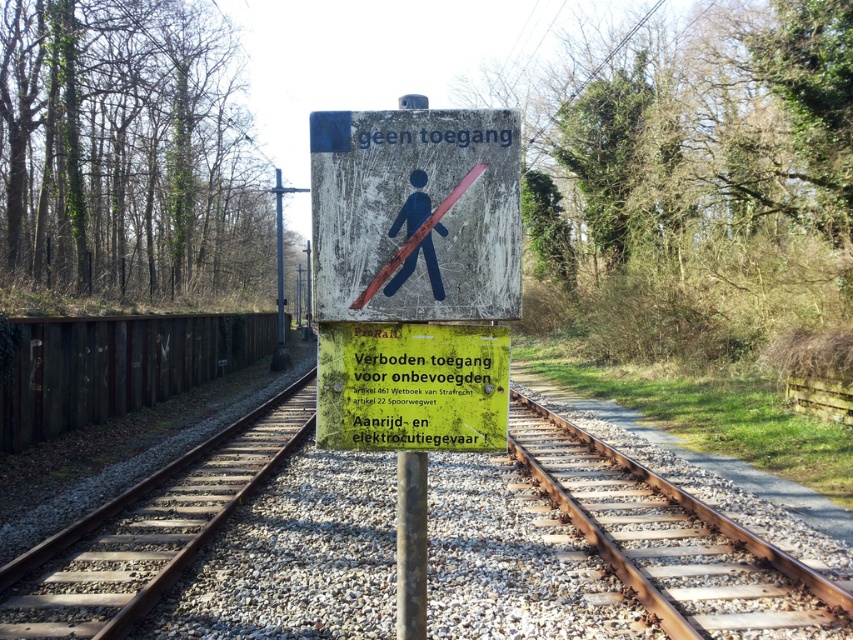
Question: Which point is farther from the camera taking this photo?

Choices:
 (A) (500, 148)
 (B) (398, 616)
 (C) (351, 349)

Answer: (B)

Question: Is gravel railway track at center further to camera compared to yellow-green plastic sign at center?

Choices:
 (A) yes
 (B) no

Answer: (A)

Question: Which object is closer to the camera taking this photo?

Choices:
 (A) weathered wood sign at center
 (B) gravel railway track at center

Answer: (A)

Question: Can you confirm if gravel railway track at center is wider than weathered wood sign at center?

Choices:
 (A) no
 (B) yes

Answer: (B)

Question: Which point is closer to the camera?

Choices:
 (A) rusty metal pole at center
 (B) gravel railway track at center

Answer: (A)

Question: Can you confirm if weathered wood sign at center is positioned to the left of yellow-green plastic sign at center?

Choices:
 (A) yes
 (B) no

Answer: (B)